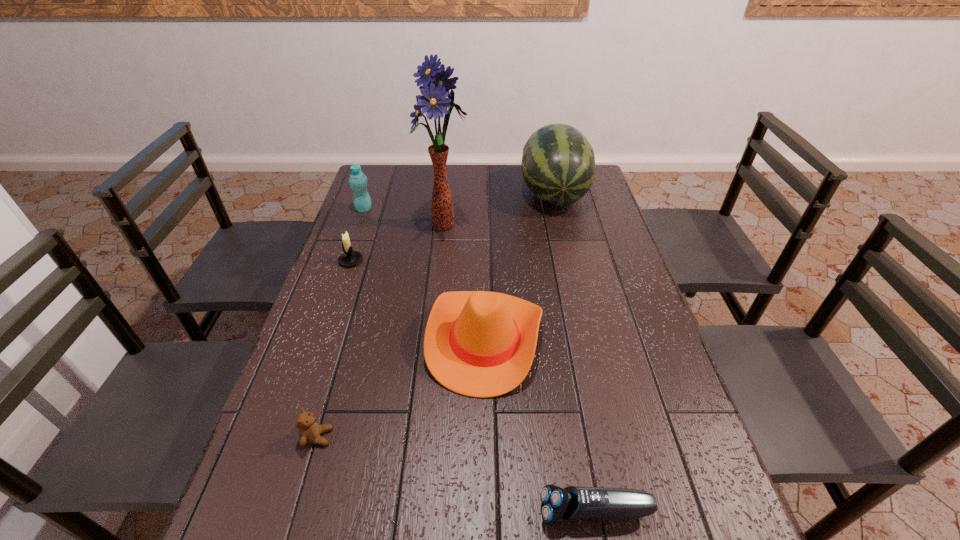
You are a GUI agent. You are given a task and a screenshot of the screen. Output one action in this format:
    pyautogui.click(x=<x>, y=<y>)
    Task: Click on the bottle that is at the left edge
    The image size is (960, 540).
    Given the screenshot: What is the action you would take?
    pyautogui.click(x=358, y=181)

At what (x,y) coordinates should I click in order to perform the action: click on candle holder located at the left edge. Please return your answer as a coordinate pair (x, y). The height and width of the screenshot is (540, 960). Looking at the image, I should click on (349, 258).

Where is `teddy bear located at the left edge`? teddy bear located at the left edge is located at coordinates (309, 430).

Find the location of a particular element. The image size is (960, 540). watermelon that is positioned at the right edge is located at coordinates (558, 164).

Locate an element on the screen. The width and height of the screenshot is (960, 540). electric shaver present at the right edge is located at coordinates (572, 503).

This screenshot has width=960, height=540. I want to click on object that is positioned at the far right corner, so click(x=558, y=164).

Locate an element on the screen. blank space at the far edge of the desktop is located at coordinates (520, 187).

In the image, there is a desktop. At what (x,y) coordinates should I click in order to perform the action: click on free space at the left edge. Please return your answer as a coordinate pair (x, y). The height and width of the screenshot is (540, 960). Looking at the image, I should click on (268, 439).

At what (x,y) coordinates should I click in order to perform the action: click on vacant space at the far left corner of the desktop. Please return your answer as a coordinate pair (x, y). This screenshot has height=540, width=960. Looking at the image, I should click on tap(388, 189).

This screenshot has height=540, width=960. I want to click on free space at the far right corner, so click(595, 174).